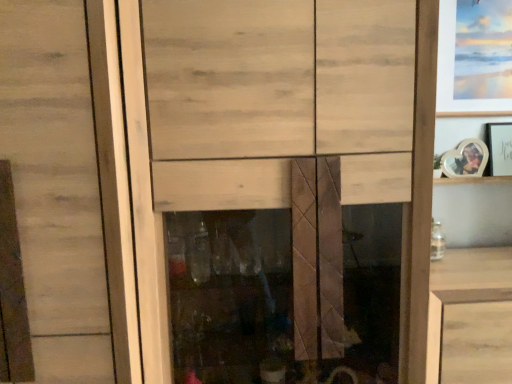
Question: Does point [x=452, y=84] appear closer or farther from the camera than point [x=450, y=152]?

Choices:
 (A) farther
 (B) closer

Answer: (B)

Question: From their relative heights in the image, would you say matte white picture frame at upper right, the 3th picture frame ordered from the bottom, is taller or shorter than wooden heart-shaped photo frame at upper right, the 3th picture frame when ordered from top to bottom?

Choices:
 (A) short
 (B) tall

Answer: (B)

Question: Which of these objects is positioned closest to the wooden heart-shaped photo frame at upper right, the 3th picture frame when ordered from top to bottom?

Choices:
 (A) wooden frame at right
 (B) wooden photo frame at upper right, placed as the 2th picture frame when sorted from top to bottom
 (C) wooden cabinet at lower right
 (D) matte white picture frame at upper right, the 3th picture frame ordered from the bottom

Answer: (A)

Question: Based on their relative distances, which object is farther from the wooden frame at right?

Choices:
 (A) wooden heart-shaped photo frame at upper right, which is counted as the 1th picture frame, starting from the bottom
 (B) wooden cabinet at lower right
 (C) matte white picture frame at upper right, which appears as the first picture frame when viewed from the top
 (D) wooden photo frame at upper right, the second picture frame ordered from the bottom

Answer: (B)